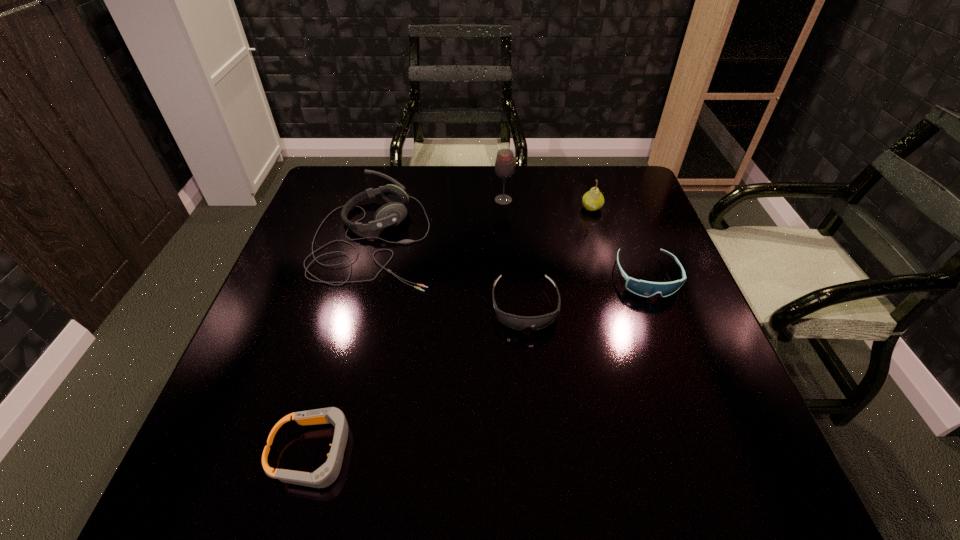
Find the location of `vacant position located on the front-facing side of the rightmost goggles`. vacant position located on the front-facing side of the rightmost goggles is located at coordinates (684, 375).

You are a GUI agent. You are given a task and a screenshot of the screen. Output one action in this format:
    pyautogui.click(x=<x>, y=<y>)
    Task: Click on the vacant space situated on the lenses of the second goggles from right to left
    Image resolution: width=960 pixels, height=540 pixels.
    Given the screenshot: What is the action you would take?
    pyautogui.click(x=534, y=402)

Find the location of a particular element. This screenshot has width=960, height=540. free space located 0.350m on the front and back of the nearest goggles is located at coordinates (559, 453).

Locate an element on the screen. The image size is (960, 540). glass drink container positioned at the far edge is located at coordinates (504, 165).

Where is `pear at the far edge`? The width and height of the screenshot is (960, 540). pear at the far edge is located at coordinates (593, 200).

The image size is (960, 540). In order to click on headset located in the far edge section of the desktop in this screenshot , I will do `click(391, 214)`.

Locate an element on the screen. The width and height of the screenshot is (960, 540). object located in the near edge section of the desktop is located at coordinates click(325, 475).

Where is `headset situated at the left edge`? headset situated at the left edge is located at coordinates (391, 214).

The image size is (960, 540). What are the coordinates of `goggles that is at the left edge` in the screenshot? It's located at (325, 475).

Locate an element on the screen. The width and height of the screenshot is (960, 540). pear that is at the right edge is located at coordinates (593, 200).